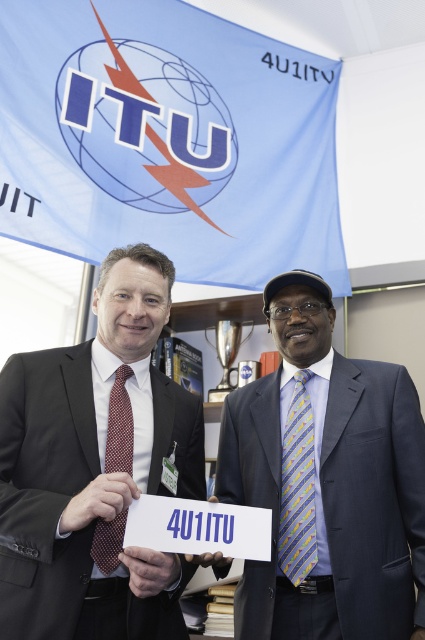
You are a photographer setting up for a formal event. You need to position a camera so that both the blue silk suit at center and the polka dot silk tie at center are clearly visible in the frame. Given their distance apart, what is the minimum width of the camera lens required to capture both objects without cropping?

The blue silk suit at center and the polka dot silk tie at center are 46.16 centimeters apart. To capture both in the frame without cropping, the camera lens must have a minimum width of at least 46.16 centimeters.

Consider the image. You are an event organizer arranging a photo shoot for two models wearing the blue silk suit at center and the matte black suit at center. Based on their positions in the image, which suit is positioned lower in the frame?

The blue silk suit at center is located below the matte black suit at center, so the blue silk suit at center is positioned lower in the frame.

You are organizing a photo shoot and need to arrange the two models wearing the blue silk suit at center and the matte black suit at center in a line. According to the image, which model should stand to the left of the other when facing the camera?

The matte black suit at center should be positioned to the left of the blue silk suit at center because the blue silk suit at center is on the right side of the matte black suit at center in the original image.